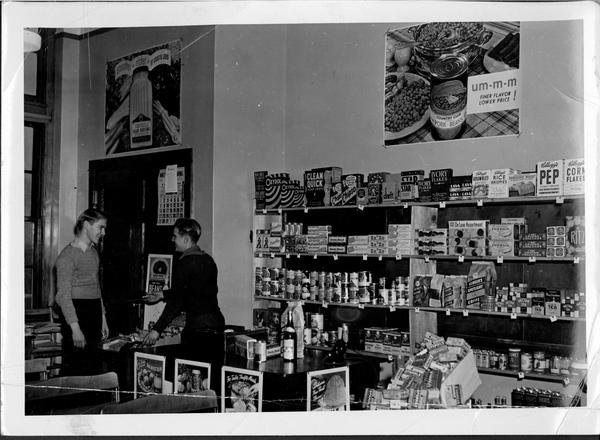
At what (x,y) coordinates should I click in order to perform the action: click on top shelf boxes. Please return your answer as a coordinate pair (x, y). Looking at the image, I should click on (280, 185), (321, 185), (553, 175), (568, 176), (486, 179), (447, 174), (409, 184), (373, 185), (351, 186).